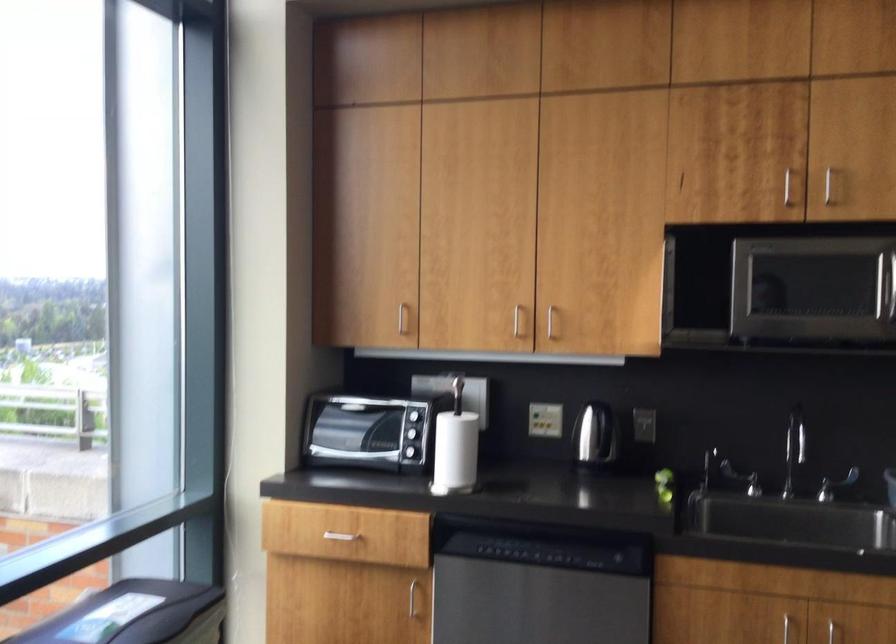
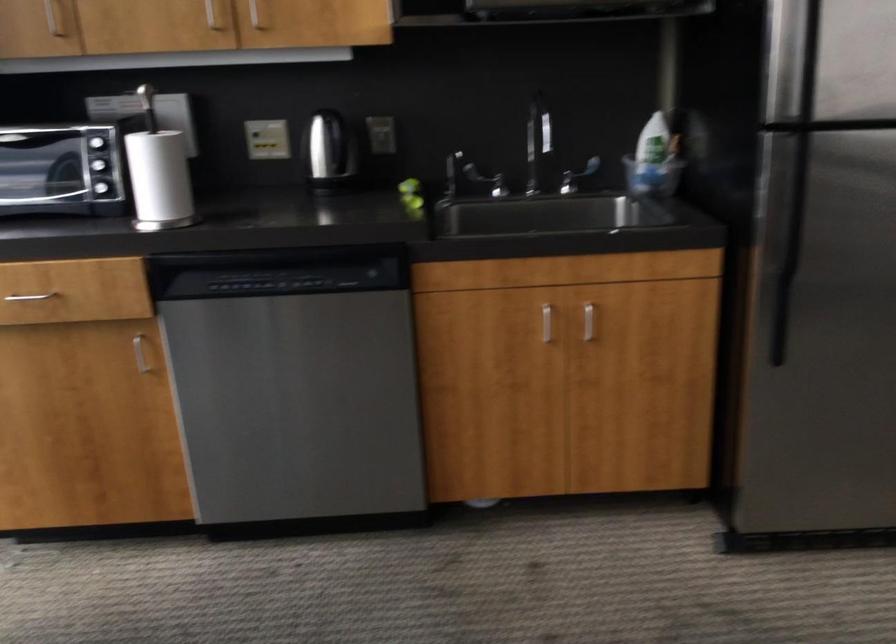
First-person continuous shooting, in which direction is the camera rotating?

The camera's rotation is toward right-down.